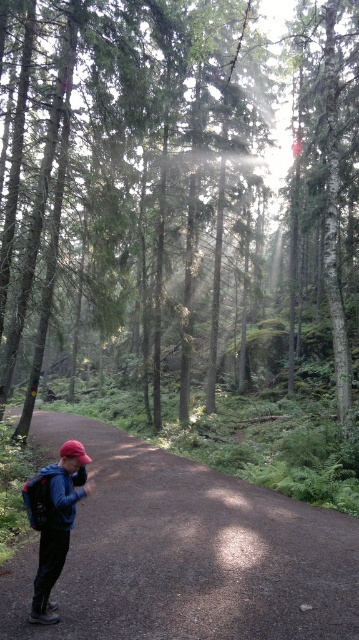
You are standing at the starting point of the path in the forest. You want to reach the green matte tree at center. Which direction should you walk to get there?

You should walk towards the center of the forest to reach the green matte tree at center, as it is located at point coordinates of (184, 179).

You are a hiker who needs to place your matte black backpack at lower left on the ground without it being too far from the brown dirt trail at lower center. Given that you can only move 10 feet from the trail, will you be able to place it within your movement limit?

The distance between the brown dirt trail at lower center and the matte black backpack at lower left is 13.19 feet, which exceeds your 10 feet movement limit. Therefore, you cannot place the matte black backpack at lower left within the allowed distance.

You are a hiker who wants to ensure your backpack is visible to others. Given that you are wearing the matte blue jacket at lower left and carrying the matte black backpack at lower left, which item is taller and therefore more visible from above?

The matte blue jacket at lower left has a greater height compared to the matte black backpack at lower left, so the jacket is taller and more visible from above.